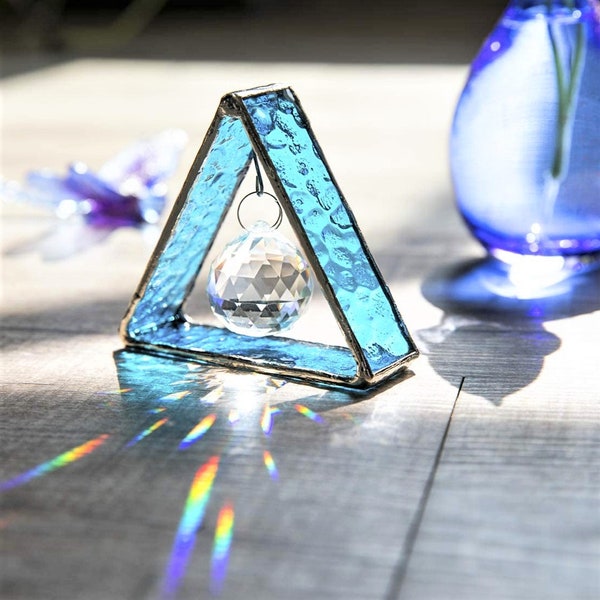
This screenshot has width=600, height=600. Identify the location of table. (422, 182).